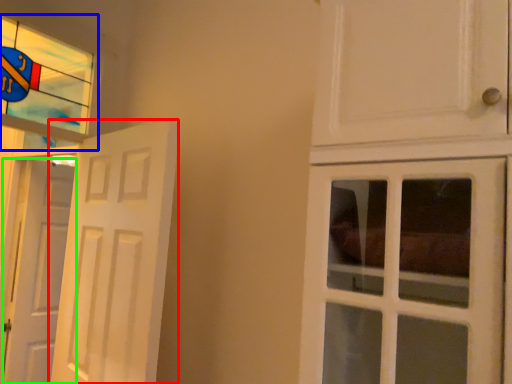
Question: Which object is the closest to the door (highlighted by a red box)? Choose among these: window (highlighted by a blue box) or door (highlighted by a green box).

Choices:
 (A) window
 (B) door

Answer: (A)